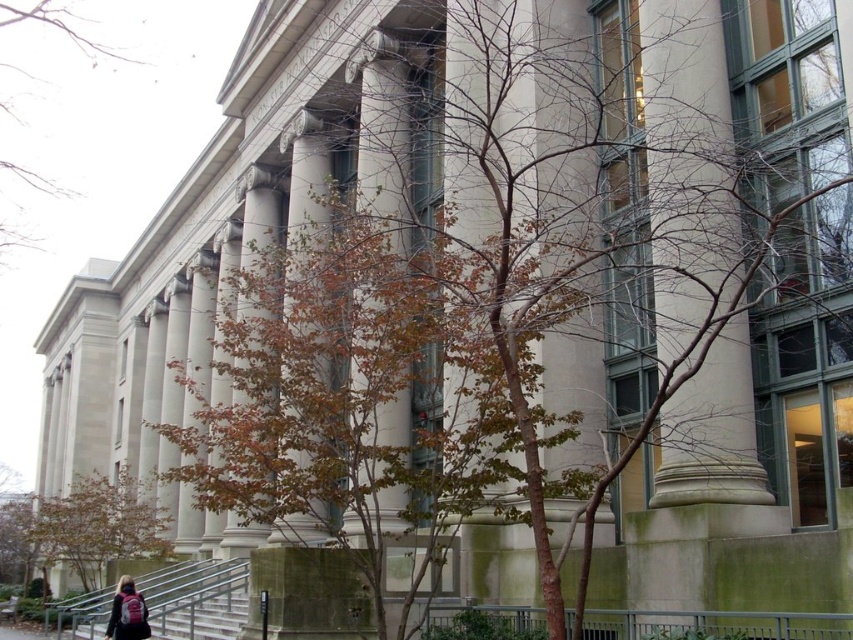
You are standing in front of the grand neoclassical building and notice a brown leafy tree at lower left and a pink fabric backpack at lower left. Which object is larger in size?

The brown leafy tree at lower left is bigger than the pink fabric backpack at lower left according to the description.